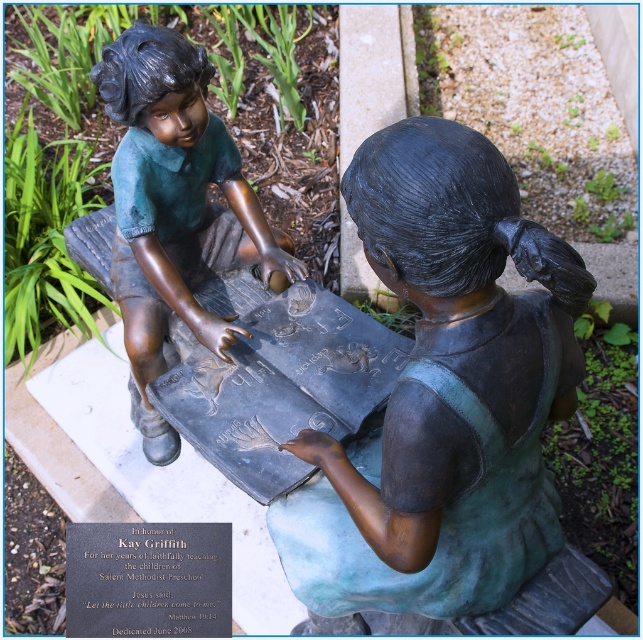
Question: Where is green patina bronze statue at center located in relation to bronze statue at upper left in the image?

Choices:
 (A) right
 (B) left

Answer: (A)

Question: Does green patina bronze statue at center appear over bronze statue at upper left?

Choices:
 (A) yes
 (B) no

Answer: (B)

Question: Does green patina bronze statue at center have a smaller size compared to bronze statue at upper left?

Choices:
 (A) yes
 (B) no

Answer: (A)